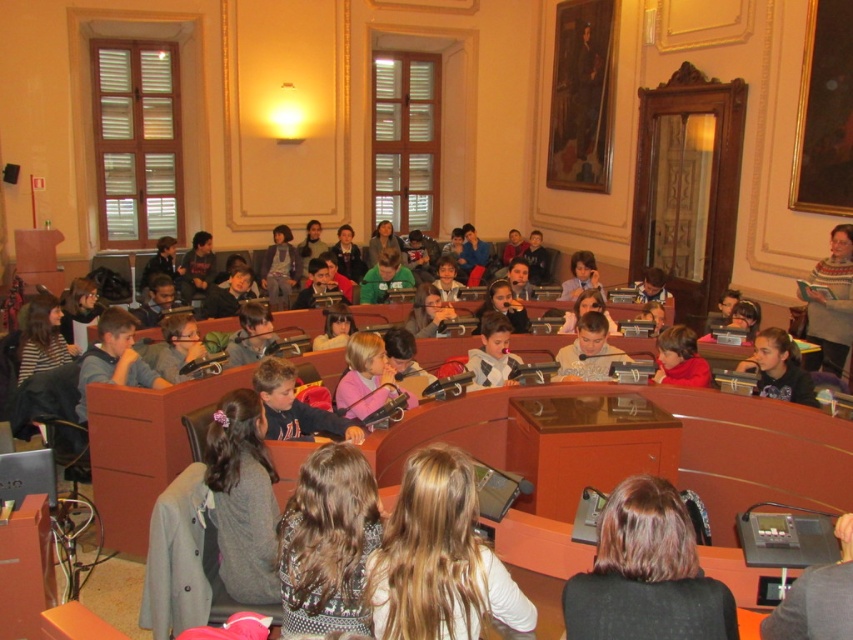
What do you see at coordinates (439, 557) in the screenshot? This screenshot has height=640, width=853. I see `blonde hair at center` at bounding box center [439, 557].

Who is shorter, blonde hair at center or brown hair at center?

Standing shorter between the two is brown hair at center.

This screenshot has height=640, width=853. I want to click on blonde hair at center, so click(439, 557).